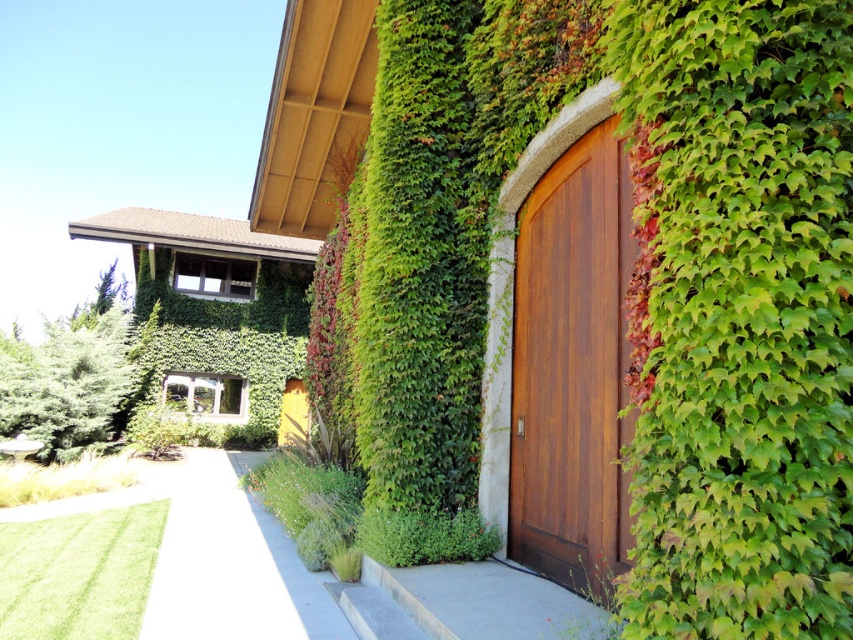
You are a visitor approaching the yellow matte door at center and want to walk along the white concrete path at lower center. Can you reach the door from the path without stepping off it?

The white concrete path at lower center is shorter than the yellow matte door at center, so the path does not extend far enough to reach the door. You would need to step off the path to reach the door.

You are a visitor approaching the entrance of the building. You see the shiny brown wood door at center and the white concrete path at lower center. Which object takes up more area in the scene?

The white concrete path at lower center takes up more area than the shiny brown wood door at center because the shiny brown wood door at center occupies less space than white concrete path at lower center.

You are standing on the white concrete path at lower center and want to enter the shiny brown wood door at center. In which direction should you walk to reach the door?

You should walk to the right since the shiny brown wood door at center is to the right of the white concrete path at lower center.